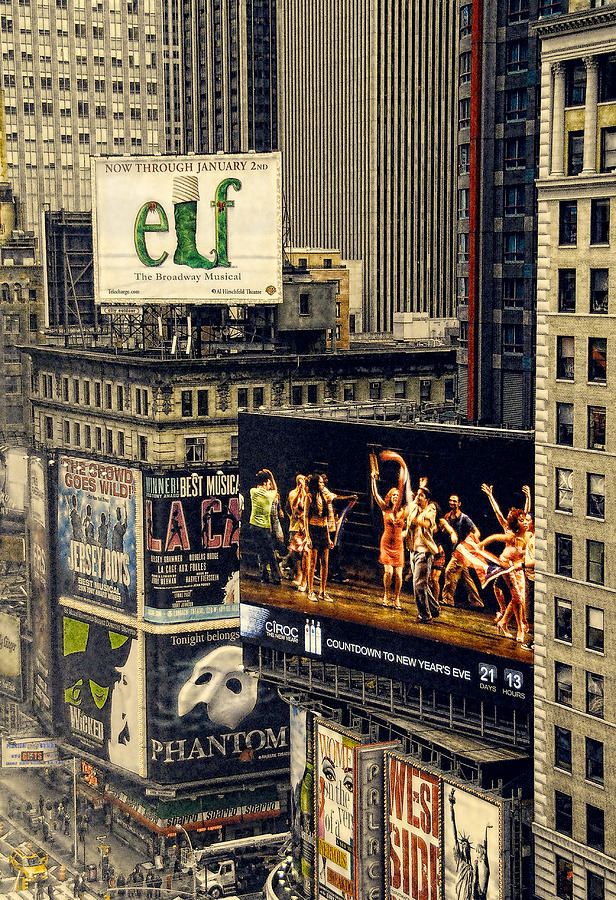
I want to click on elf poster, so click(180, 226).